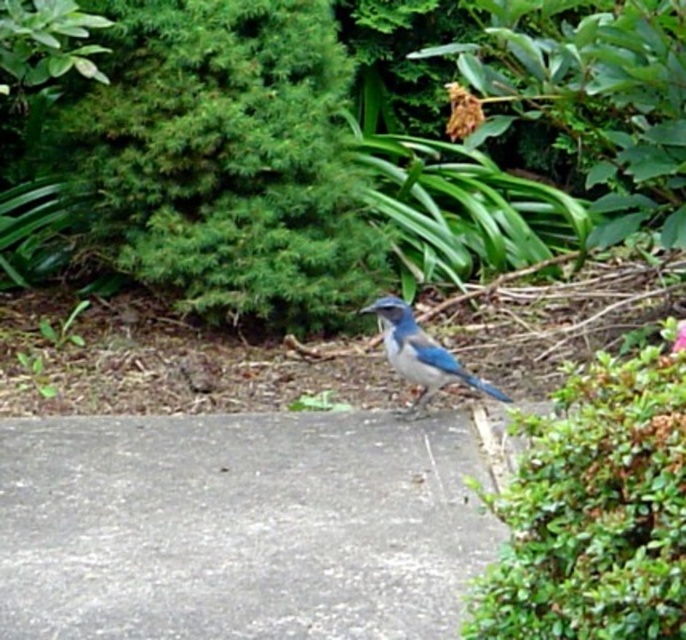
Between point (320, 458) and point (650, 376), which one is positioned in front?

Point (650, 376)

Between point (471, 547) and point (619, 474), which one is positioned behind?

The point (471, 547) is more distant.

Which is in front, point (38, 625) or point (528, 628)?

Point (528, 628)

This screenshot has height=640, width=686. I want to click on gray concrete pavement at center, so click(x=239, y=525).

Measure the distance from green leafy bush at upper left to blue glossy bird at center.

4.80 feet

Does green leafy bush at upper left have a lesser height compared to blue glossy bird at center?

No, green leafy bush at upper left is not shorter than blue glossy bird at center.

Where is `green leafy bush at upper left`? The image size is (686, 640). green leafy bush at upper left is located at coordinates (226, 161).

Which is in front, point (359, 532) or point (403, 304)?

Positioned in front is point (359, 532).

Is gray concrete pavement at center positioned at the back of blue glossy bird at center?

No, it is in front of blue glossy bird at center.

Who is more forward, (94, 444) or (469, 381)?

Point (94, 444) is more forward.

Where is `gray concrete pavement at center`? The image size is (686, 640). gray concrete pavement at center is located at coordinates (239, 525).